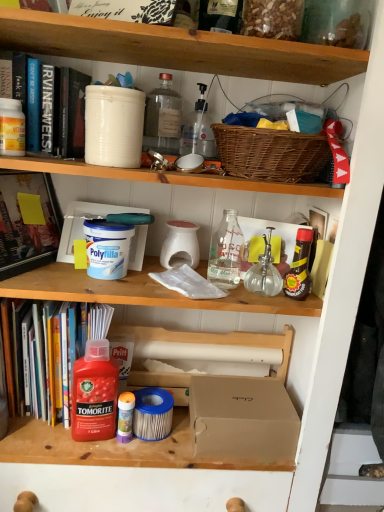
Question: Can you confirm if hardcover book at upper left, the 1th book in the top-to-bottom sequence, is wider than white matte polyfilla container at center-left, positioned as the 2th box in bottom-to-top order?

Choices:
 (A) yes
 (B) no

Answer: (A)

Question: Is hardcover book at upper left, which is the third book from bottom to top, to the left of white matte polyfilla container at center-left, positioned as the 2th box in bottom-to-top order, from the viewer's perspective?

Choices:
 (A) no
 (B) yes

Answer: (B)

Question: Is hardcover book at upper left, which is the third book from bottom to top, oriented away from white matte polyfilla container at center-left, arranged as the 1th box when viewed from the top?

Choices:
 (A) yes
 (B) no

Answer: (B)

Question: From the image's perspective, is hardcover book at upper left, which is the third book from bottom to top, located above white matte polyfilla container at center-left, arranged as the 1th box when viewed from the top?

Choices:
 (A) no
 (B) yes

Answer: (B)

Question: Can you confirm if hardcover book at upper left, the 1th book in the top-to-bottom sequence, is taller than white matte polyfilla container at center-left, positioned as the 2th box in bottom-to-top order?

Choices:
 (A) no
 (B) yes

Answer: (A)

Question: Could you tell me if hardcover book at upper left, which is the third book from bottom to top, is facing white matte polyfilla container at center-left, the 2th box positioned from the right?

Choices:
 (A) no
 (B) yes

Answer: (A)

Question: Can you confirm if hardcover book at upper left, the 1th book in the top-to-bottom sequence, is smaller than brown cardboard box at center, placed as the first box when sorted from right to left?

Choices:
 (A) yes
 (B) no

Answer: (B)

Question: Is there a large distance between hardcover book at upper left, the 1th book in the top-to-bottom sequence, and brown cardboard box at center, positioned as the 2th box in top-to-bottom order?

Choices:
 (A) no
 (B) yes

Answer: (A)

Question: From a real-world perspective, is hardcover book at upper left, the 1th book in the top-to-bottom sequence, on brown cardboard box at center, placed as the second box when sorted from left to right?

Choices:
 (A) no
 (B) yes

Answer: (B)

Question: Can you confirm if hardcover book at upper left, which is the third book from bottom to top, is taller than brown cardboard box at center, positioned as the 2th box in top-to-bottom order?

Choices:
 (A) yes
 (B) no

Answer: (A)

Question: Can you confirm if hardcover book at upper left, which is the third book from bottom to top, is positioned to the right of brown cardboard box at center, which is the 1th box from bottom to top?

Choices:
 (A) no
 (B) yes

Answer: (A)

Question: From the image's perspective, would you say hardcover book at upper left, the 1th book in the top-to-bottom sequence, is positioned over brown cardboard box at center, placed as the first box when sorted from right to left?

Choices:
 (A) no
 (B) yes

Answer: (B)

Question: Is translucent plastic glue stick at lower center, the sixth bottle when ordered from right to left, shorter than clear glass bottle at center, the third bottle positioned from the right?

Choices:
 (A) yes
 (B) no

Answer: (B)